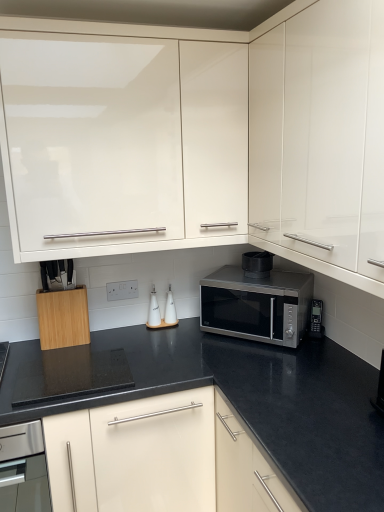
Question: In the image, is white glossy salt shaker at center, arranged as the 4th appliance when viewed from the right, on the left side or the right side of white ceramic oil bottles at center, the 2th appliance from the left?

Choices:
 (A) right
 (B) left

Answer: (B)

Question: Is white glossy salt shaker at center, the 1th appliance viewed from the left, taller or shorter than white ceramic oil bottles at center, the third appliance positioned from the right?

Choices:
 (A) short
 (B) tall

Answer: (B)

Question: Which is nearer to the black plastic phone at lower right, the 1th appliance from the right?

Choices:
 (A) black matte microwave at center, the 3th appliance viewed from the left
 (B) glossy white cabinet at upper left, which is the 2th cabinetry in left-to-right order
 (C) white glossy salt shaker at center, the 1th appliance viewed from the left
 (D) beech wood knife block at lower left, which is the 1th cabinetry in left-to-right order
 (E) white ceramic oil bottles at center, the third appliance positioned from the right

Answer: (A)

Question: Which is farther from the black matte microwave at center, the 2th appliance from the right?

Choices:
 (A) satin silver microwave at center
 (B) beech wood knife block at lower left, which is the 1th cabinetry in left-to-right order
 (C) white glossy salt shaker at center, arranged as the 4th appliance when viewed from the right
 (D) white ceramic oil bottles at center, the 2th appliance from the left
 (E) black plastic phone at lower right, the fourth appliance from the left

Answer: (B)